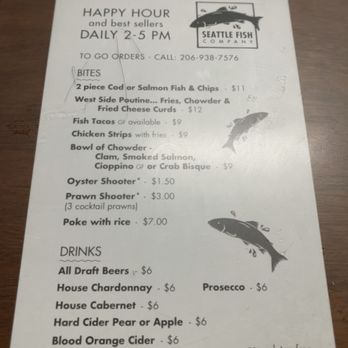
The width and height of the screenshot is (348, 348). In order to click on black wood table, background in this screenshot , I will do `click(312, 40)`.